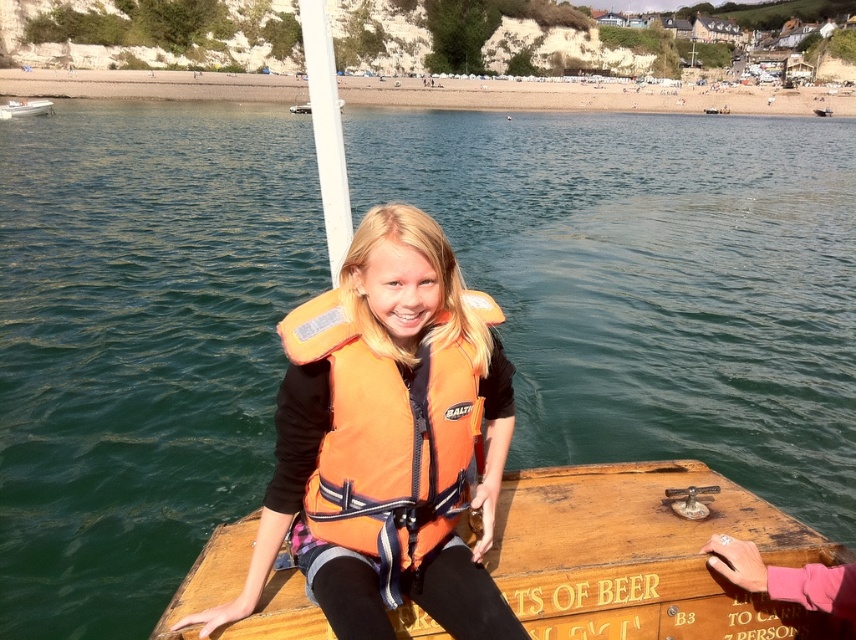
Question: In this image, where is orange life vest at center located relative to white plastic boat at upper left?

Choices:
 (A) above
 (B) below

Answer: (B)

Question: Which object is closer to the camera taking this photo?

Choices:
 (A) wooden raft at center
 (B) white plastic boat at upper left
 (C) orange fabric life jacket at center

Answer: (A)

Question: Does orange fabric life jacket at center have a greater width compared to white plastic boat at upper left?

Choices:
 (A) no
 (B) yes

Answer: (A)

Question: Can you confirm if wooden raft at center is thinner than white plastic boat at upper left?

Choices:
 (A) no
 (B) yes

Answer: (A)

Question: Which point is farther to the camera?

Choices:
 (A) white plastic boat at upper left
 (B) wooden raft at center

Answer: (A)

Question: Which object is the farthest from the white plastic boat at upper left?

Choices:
 (A) orange life vest at center
 (B) wooden raft at center

Answer: (B)